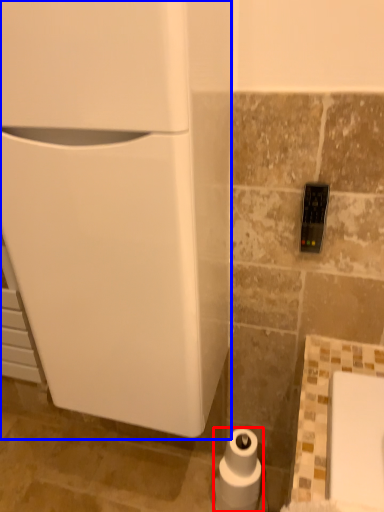
Question: Among these objects, which one is nearest to the camera, toilet paper (highlighted by a red box) or appliance (highlighted by a blue box)?

Choices:
 (A) toilet paper
 (B) appliance

Answer: (B)